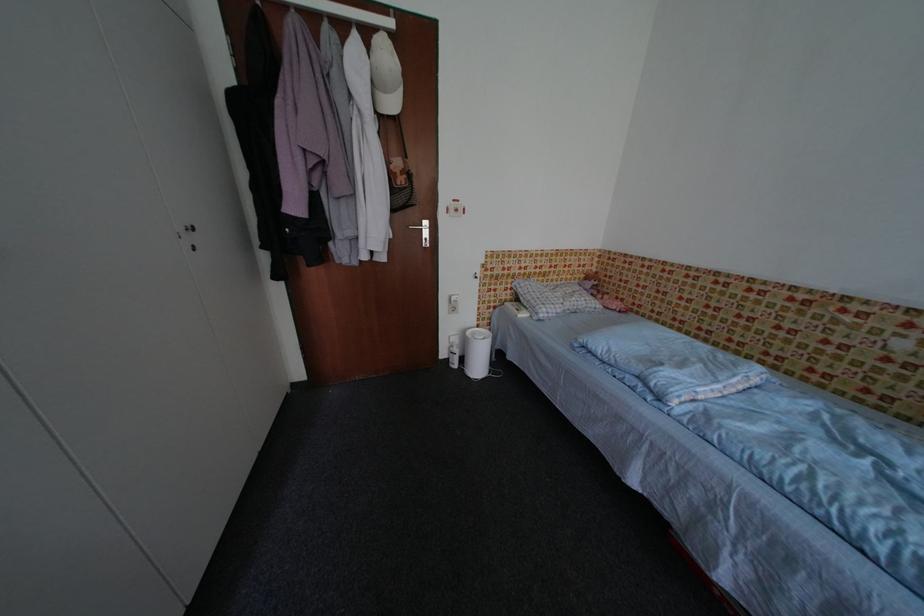
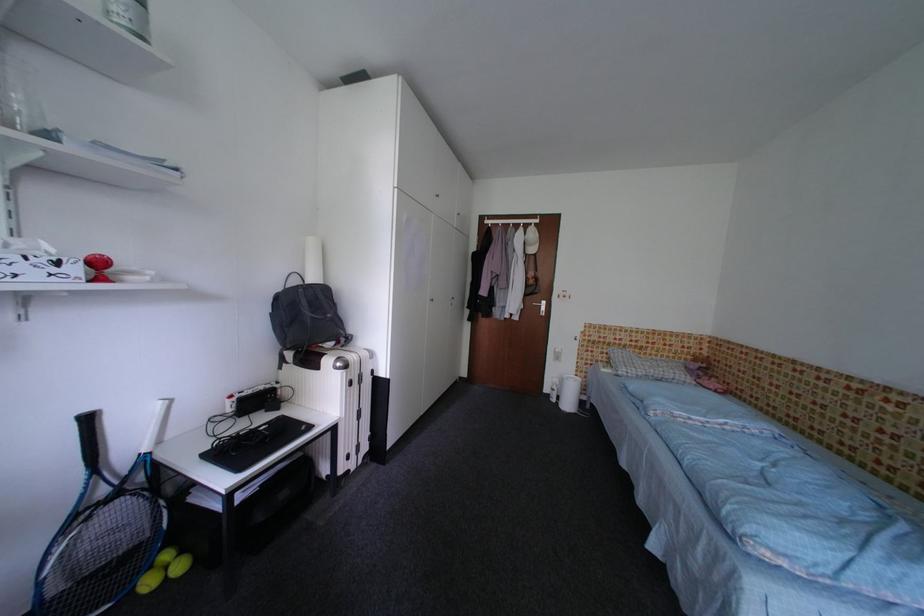
In the second image, find the point that corresponds to pixel 363 41 in the first image.

(529, 232)